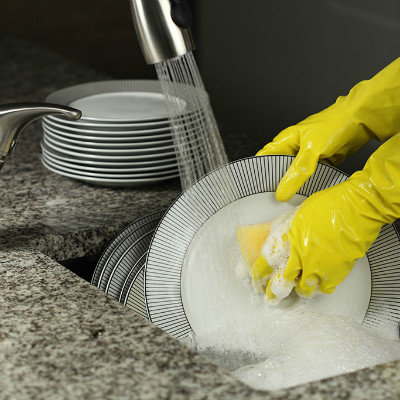
What are the coordinates of `water in sink` in the screenshot? It's located at (217, 359).